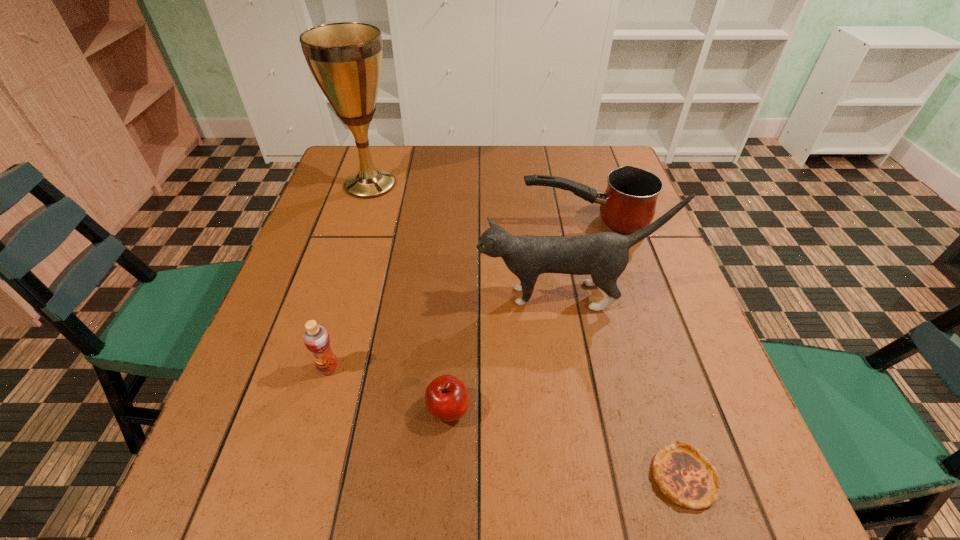
The height and width of the screenshot is (540, 960). Identify the location of free space at the near edge of the desktop. (553, 530).

At what (x,y) coordinates should I click in order to perform the action: click on blank space at the left edge of the desktop. Please return your answer as a coordinate pair (x, y). The image size is (960, 540). Looking at the image, I should click on 312,291.

In the image, there is a desktop. At what (x,y) coordinates should I click in order to perform the action: click on blank space at the right edge. Please return your answer as a coordinate pair (x, y). The image size is (960, 540). Looking at the image, I should click on (668, 321).

In the image, there is a desktop. In order to click on vacant space at the far right corner in this screenshot , I will do `click(598, 184)`.

Locate an element on the screen. The width and height of the screenshot is (960, 540). blank region between the fifth tallest object and the farthest object is located at coordinates (409, 296).

This screenshot has width=960, height=540. What are the coordinates of `vacant area that lies between the tallest object and the saucepan` in the screenshot? It's located at (477, 203).

Locate an element on the screen. empty space between the trophy cup and the saucepan is located at coordinates (477, 203).

This screenshot has height=540, width=960. I want to click on vacant space that is in between the fourth farthest object and the fifth nearest object, so click(457, 295).

The image size is (960, 540). What are the coordinates of `unoccupied position between the fourth nearest object and the orange juice` in the screenshot? It's located at (447, 332).

Where is `empty space between the saucepan and the shortest object`? The height and width of the screenshot is (540, 960). empty space between the saucepan and the shortest object is located at coordinates (635, 349).